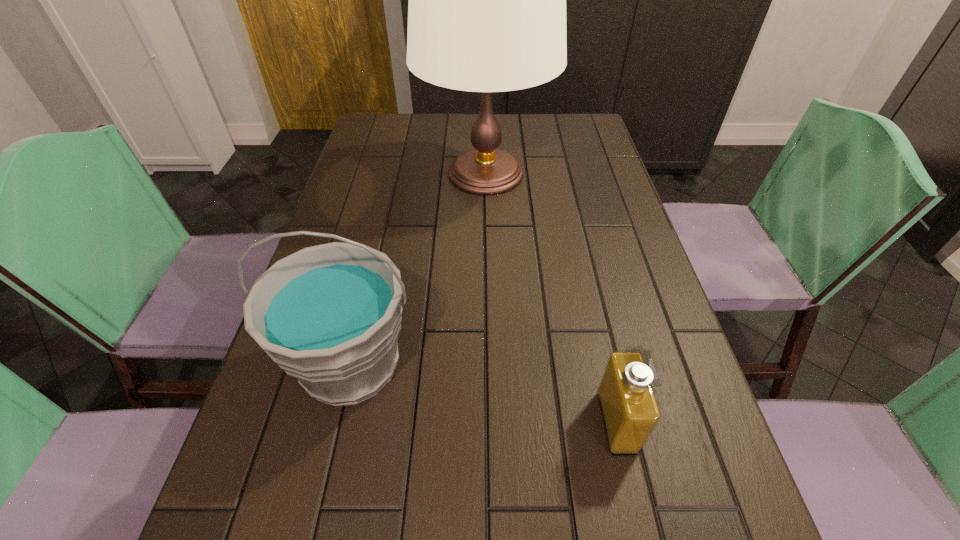
Locate an element on the screen. object present at the far edge is located at coordinates (487, 0).

Find the location of `object located at the left edge`. object located at the left edge is located at coordinates (329, 315).

Identify the location of object that is at the right edge. Image resolution: width=960 pixels, height=540 pixels. (630, 412).

Find the location of a particular element. vacant space at the far edge of the desktop is located at coordinates (539, 137).

At what (x,y) coordinates should I click in order to perform the action: click on free space at the left edge of the desktop. Please return your answer as a coordinate pair (x, y). The width and height of the screenshot is (960, 540). Looking at the image, I should click on (357, 223).

Locate an element on the screen. The image size is (960, 540). vacant space at the right edge of the desktop is located at coordinates (600, 234).

In the image, there is a desktop. Find the location of `free space at the far right corner`. free space at the far right corner is located at coordinates (560, 130).

Image resolution: width=960 pixels, height=540 pixels. I want to click on free space between the tallest object and the perfume, so click(x=551, y=298).

You are a GUI agent. You are given a task and a screenshot of the screen. Output one action in this format:
    pyautogui.click(x=<x>, y=<y>)
    Task: Click on the vacant point located between the farthest object and the bucket
    
    Given the screenshot: What is the action you would take?
    pyautogui.click(x=419, y=269)

Locate an element on the screen. vacant area that lies between the shortest object and the bucket is located at coordinates (484, 393).